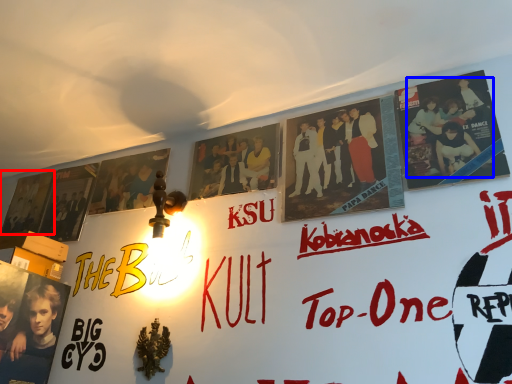
Question: Which point is further to the camera, movie poster (highlighted by a red box) or person (highlighted by a blue box)?

Choices:
 (A) movie poster
 (B) person

Answer: (A)